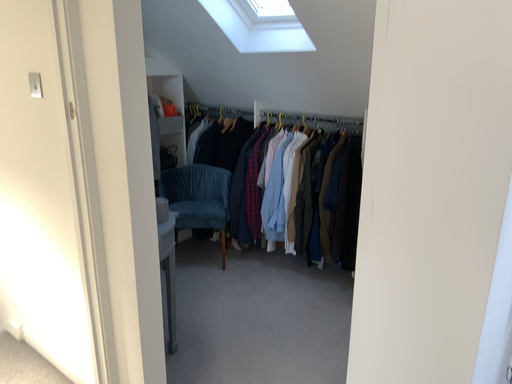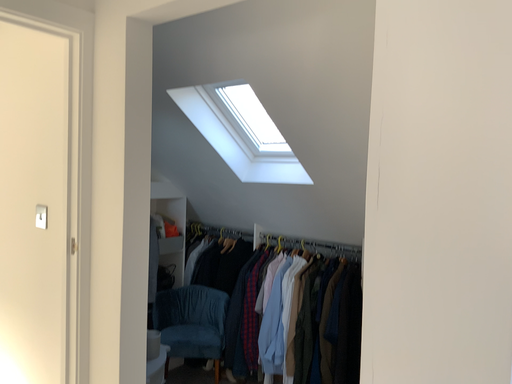
Question: How did the camera likely rotate when shooting the video?

Choices:
 (A) rotated downward
 (B) rotated upward

Answer: (B)